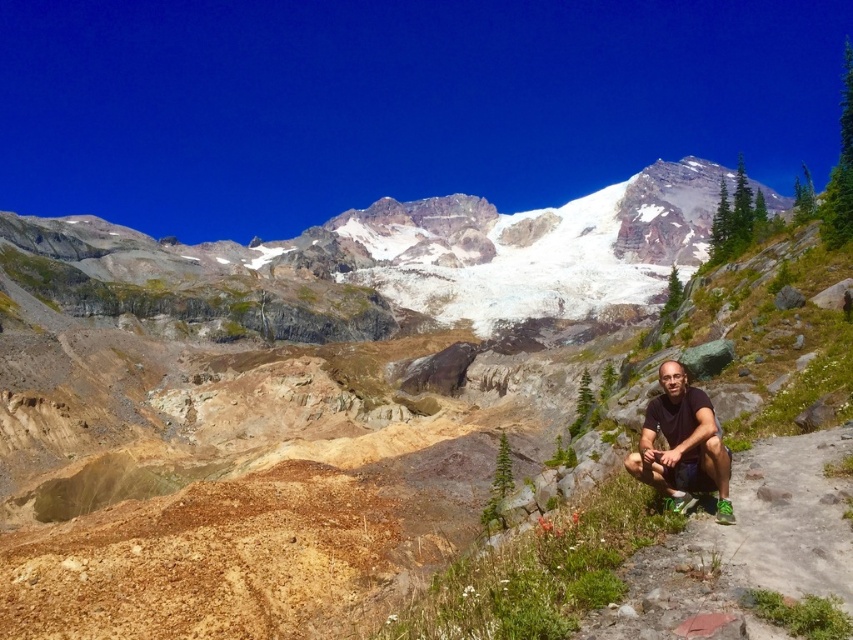
Question: Among these objects, which one is farthest from the camera?

Choices:
 (A) white rocky mountain at upper center
 (B) matte black shorts at lower right

Answer: (A)

Question: Does white rocky mountain at upper center have a smaller size compared to matte black shorts at lower right?

Choices:
 (A) no
 (B) yes

Answer: (A)

Question: Is white rocky mountain at upper center closer to camera compared to matte black shorts at lower right?

Choices:
 (A) no
 (B) yes

Answer: (A)

Question: Does white rocky mountain at upper center appear on the left side of matte black shorts at lower right?

Choices:
 (A) no
 (B) yes

Answer: (A)

Question: Which object appears closest to the camera in this image?

Choices:
 (A) matte black shorts at lower right
 (B) white rocky mountain at upper center

Answer: (A)